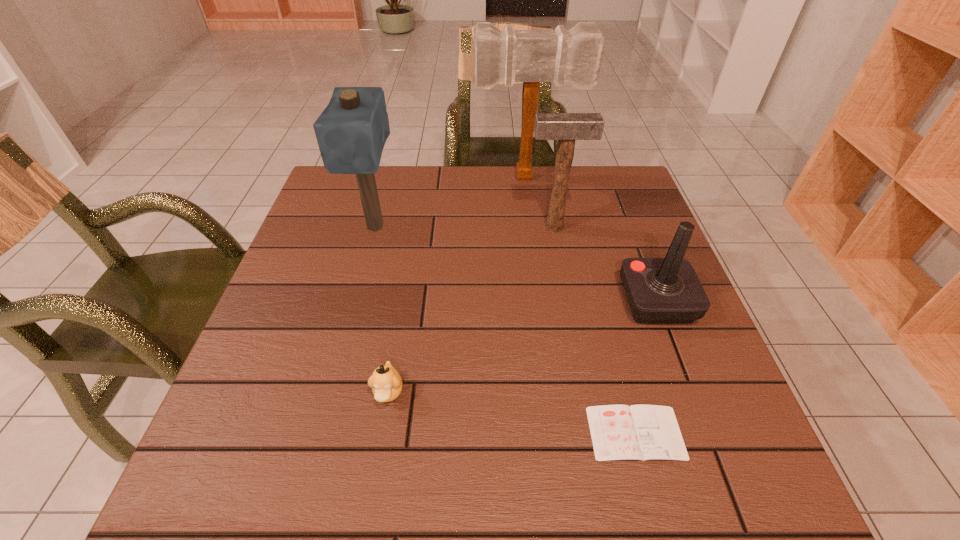
In order to click on free spot that satisfies the following two spatial constraints: 1. on the front side of the shortest object; 2. on the left side of the farthest object in this screenshot , I will do `click(561, 433)`.

In order to click on vacant area that satisfies the following two spatial constraints: 1. on the back side of the leftmost mallet; 2. on the right side of the shortest mallet in this screenshot , I will do `click(376, 226)`.

I want to click on free space that satisfies the following two spatial constraints: 1. on the front side of the diary; 2. on the left side of the farthest object, so click(x=561, y=433).